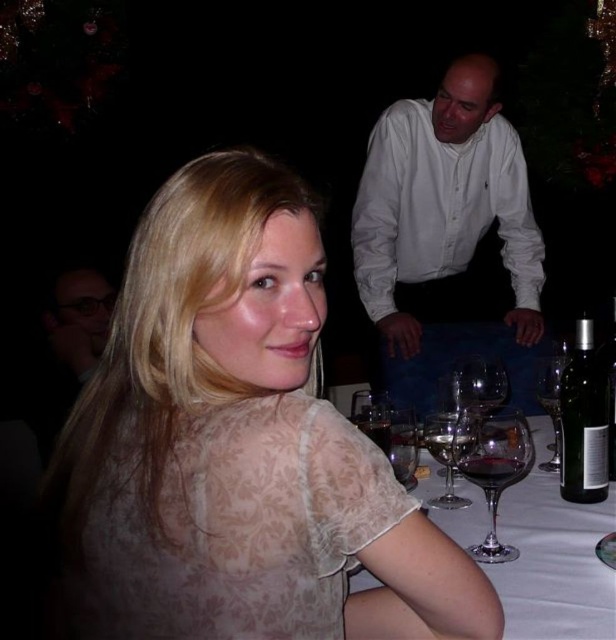
You are a waiter at a dinner event. There is a dark red glass at table right. Where is the dark red glass located in terms of coordinates?

The dark red glass at table right is located at coordinates point (492, 468).

You are a photographer trying to capture a candid shot of the scene. You want to ensure that the subject at point (x=463, y=470) is in focus. Given that your camera has a depth of field that can sharply focus objects within 30 inches from the current focal point, what is the minimum distance you should set your focal point to so that the subject is within the sharp focus range?

The distance between the point (x=463, y=470) and the camera is 34.96 inches. To ensure the subject is within the 30 inch depth of field, the focal point must be set within 4.96 inches of the subject. Therefore, the minimum focal distance should be set to 34.96 inches minus 30 inches, which equals 4.96 inches.